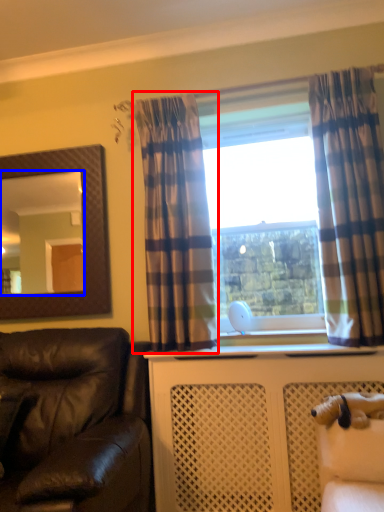
Question: Among these objects, which one is farthest to the camera, curtain (highlighted by a red box) or mirror (highlighted by a blue box)?

Choices:
 (A) curtain
 (B) mirror

Answer: (B)